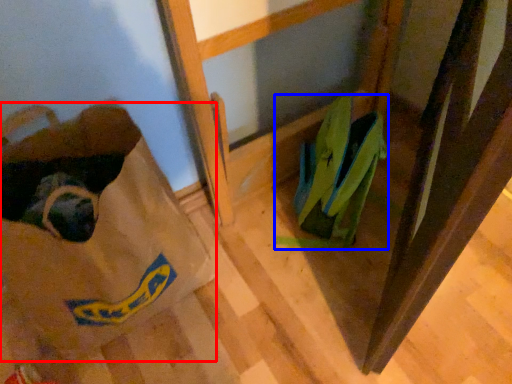
Question: Which of the following is the farthest to the observer, grocery bag (highlighted by a red box) or footwear (highlighted by a blue box)?

Choices:
 (A) grocery bag
 (B) footwear

Answer: (B)